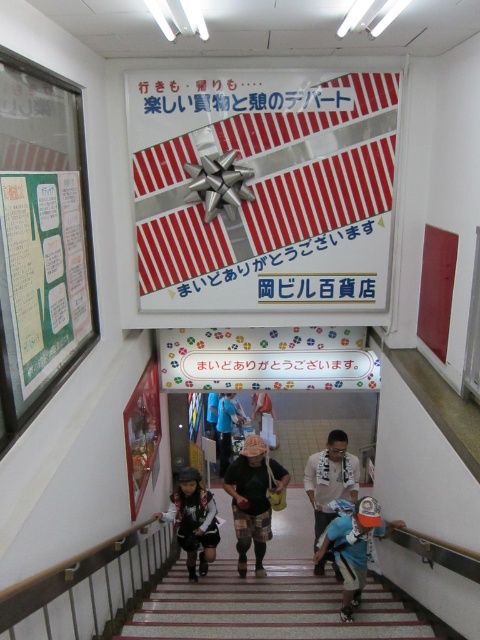
Question: Which object is positioned farthest from the silver metallic gift at upper center?

Choices:
 (A) green paper at left
 (B) blue denim jacket at lower center
 (C) camouflage pants at center

Answer: (B)

Question: Which point is farther from the camera taking this photo?

Choices:
 (A) (338, 490)
 (B) (178, 483)

Answer: (B)

Question: Does silver metallic gift at upper center have a larger size compared to blue denim jacket at lower center?

Choices:
 (A) no
 (B) yes

Answer: (B)

Question: Is silver metallic gift at upper center further to the viewer compared to camouflage pants at center?

Choices:
 (A) yes
 (B) no

Answer: (B)

Question: Which object is positioned farthest from the light blue fabric shirt at center?

Choices:
 (A) matte black helmet at lower center
 (B) blue denim jacket at lower center

Answer: (A)

Question: Is green paper at left above matte black helmet at lower center?

Choices:
 (A) no
 (B) yes

Answer: (B)